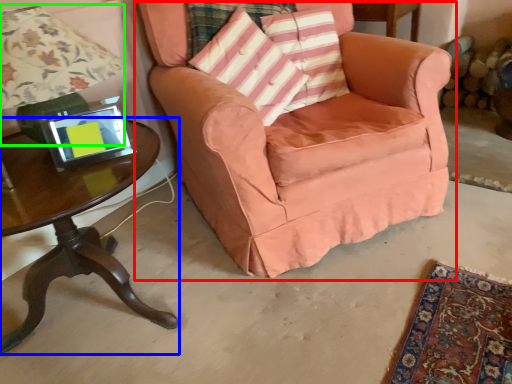
Question: Which object is positioned closest to chair (highlighted by a red box)? Select from table (highlighted by a blue box) and lamp (highlighted by a green box).

Choices:
 (A) table
 (B) lamp

Answer: (B)